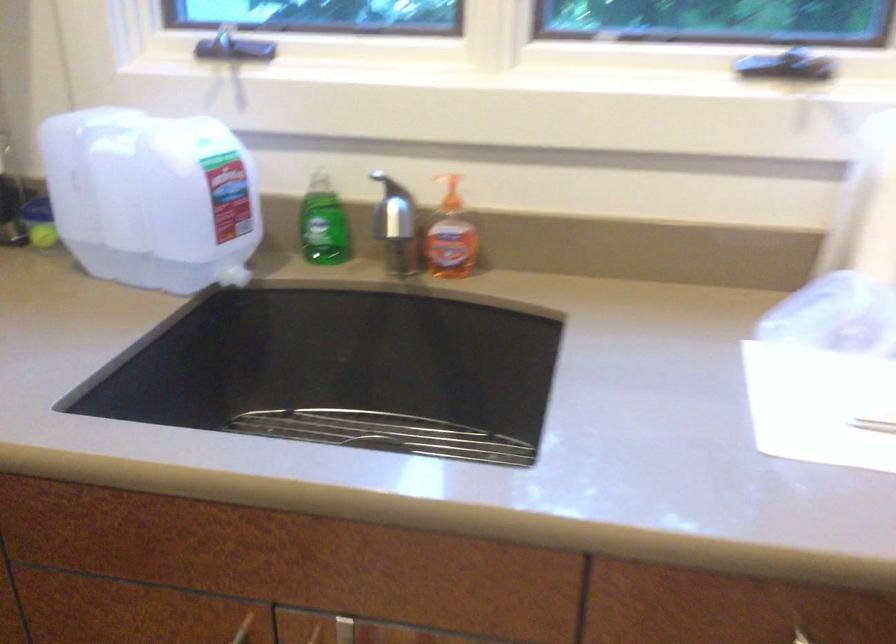
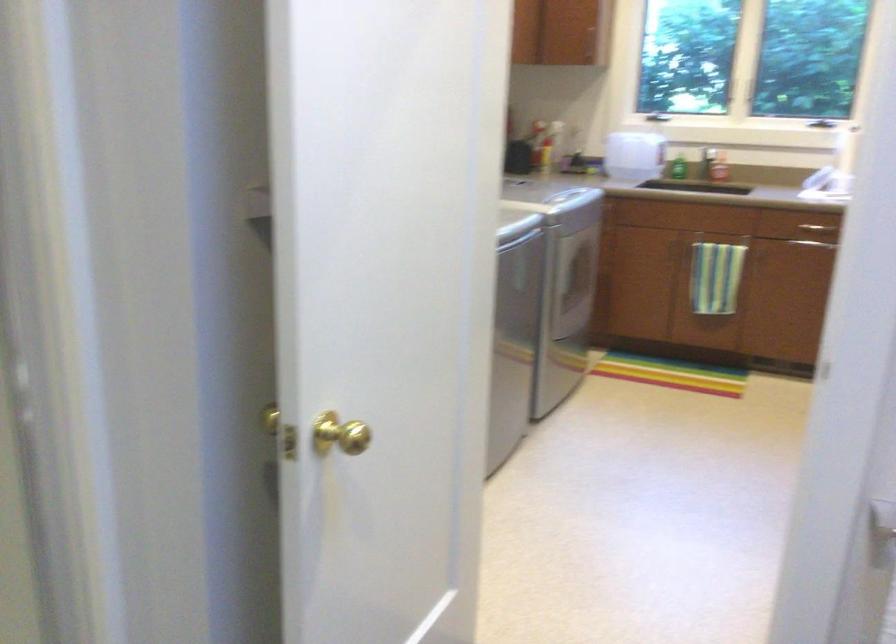
Locate, in the second image, the point that corresponds to [216,84] in the first image.

(655, 116)